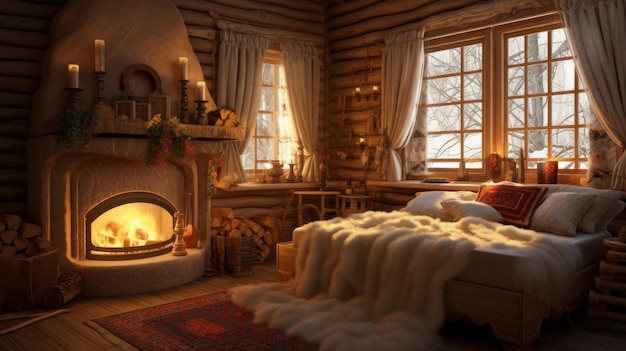
The image size is (626, 351). I want to click on windows, so click(260, 124), click(444, 104), click(548, 88).